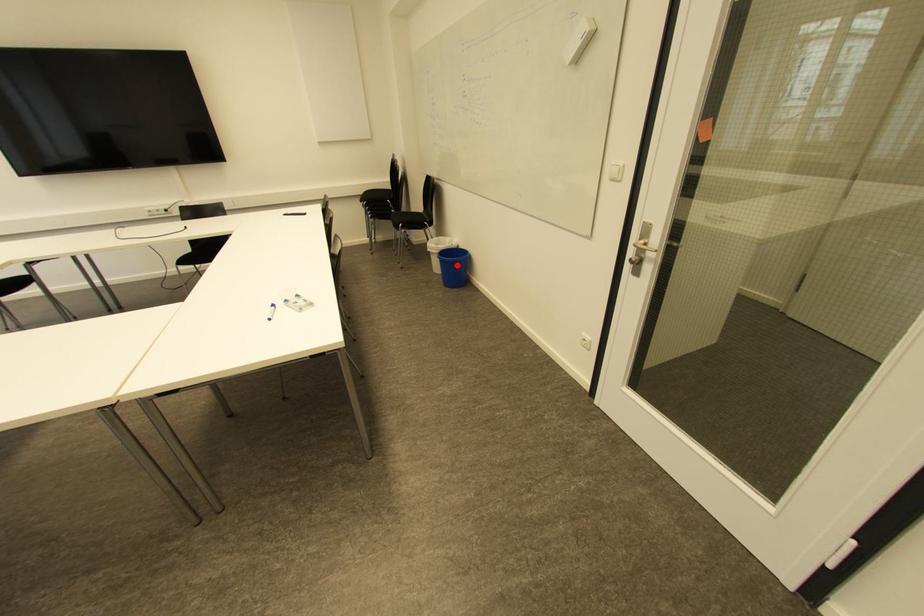
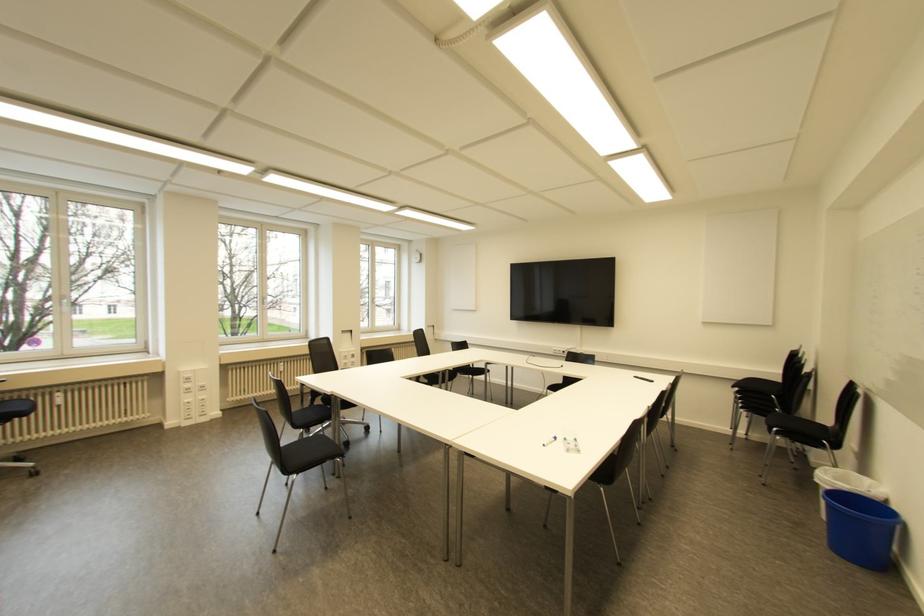
In the second image, find the point that corresponds to the highlighted location in the first image.

(864, 527)